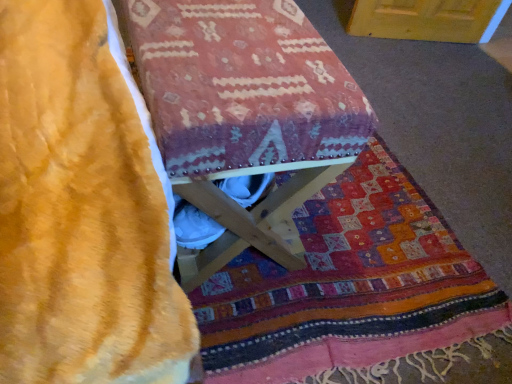
You are a GUI agent. You are given a task and a screenshot of the screen. Output one action in this format:
    pyautogui.click(x=<x>, y=<y>)
    Task: Click on the blank area beneath velvety yellow blanket at lower left (from a real-world perspective)
    The image size is (512, 384).
    Given the screenshot: What is the action you would take?
    pyautogui.click(x=349, y=292)